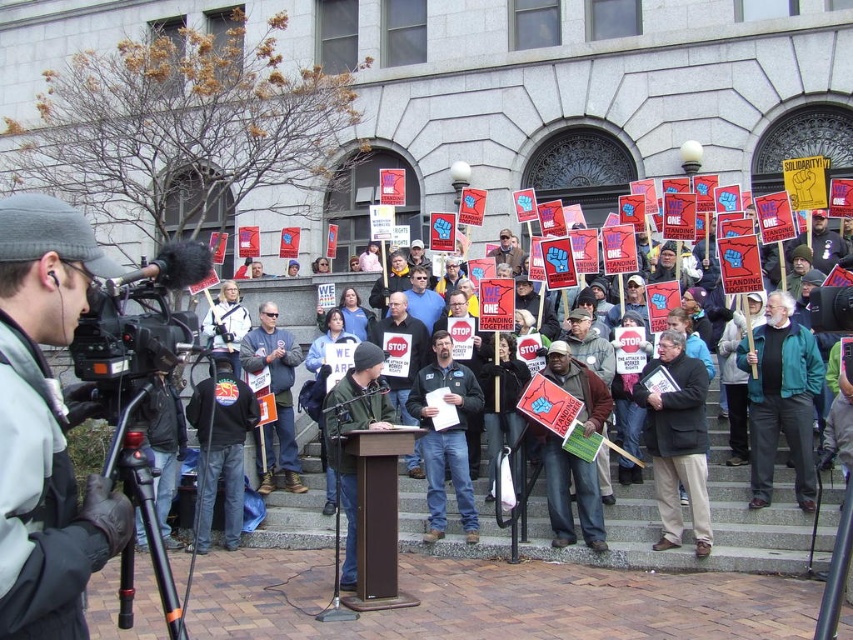
Does point (7, 240) come behind point (262, 538)?

No, (7, 240) is in front of (262, 538).

Can you confirm if matte black camera at left is wider than red paper signs at center?

No, matte black camera at left is not wider than red paper signs at center.

Between point (61, 560) and point (502, 532), which one is positioned behind?

The point (502, 532) is more distant.

Locate an element on the screen. Image resolution: width=853 pixels, height=640 pixels. matte black camera at left is located at coordinates (45, 426).

Who is shorter, matte black camera at left or black plastic video camera at left?

matte black camera at left

Can you confirm if matte black camera at left is shorter than black plastic video camera at left?

Yes.

Which is in front, point (3, 497) or point (167, 280)?

Point (3, 497)

Where is `matte black camera at left`? This screenshot has height=640, width=853. matte black camera at left is located at coordinates (45, 426).

Find the location of `red paper signs at center`. red paper signs at center is located at coordinates point(749,512).

Image resolution: width=853 pixels, height=640 pixels. What do you see at coordinates (749, 512) in the screenshot? I see `red paper signs at center` at bounding box center [749, 512].

Where is `red paper signs at center`? This screenshot has width=853, height=640. red paper signs at center is located at coordinates (749, 512).